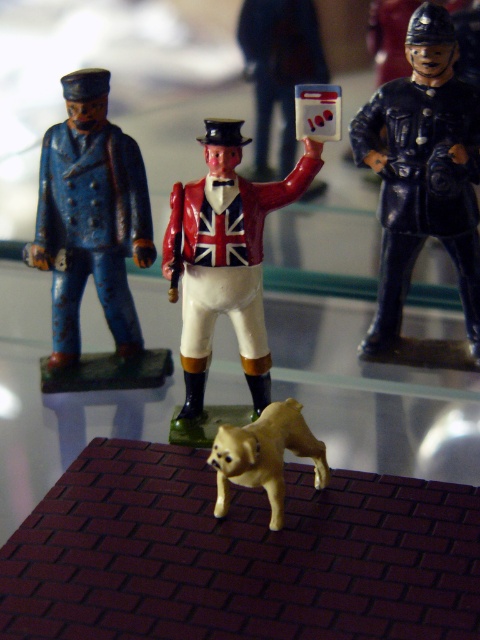
You are observing a diorama with two figures wearing uniforms. The uniforms are labeled as the glossy dark blue uniform at right and the matte blue uniform at left. Which uniform is positioned to the right of the other?

The glossy dark blue uniform at right is positioned to the right of the matte blue uniform at left.

You are a photographer setting up a miniature scene. You have a glossy dark blue uniform at right and a shiny red plastic figure at center. Which object is positioned higher in the image?

The glossy dark blue uniform at right is above the shiny red plastic figure at center, so it is positioned higher in the image.

Consider the image. You are a collector who wants to display both the shiny red plastic figure at center and the shiny gold dog at center on a shelf. Which object will occupy more space on the shelf?

The shiny red plastic figure at center is larger than the shiny gold dog at center, so it will occupy more space on the shelf.